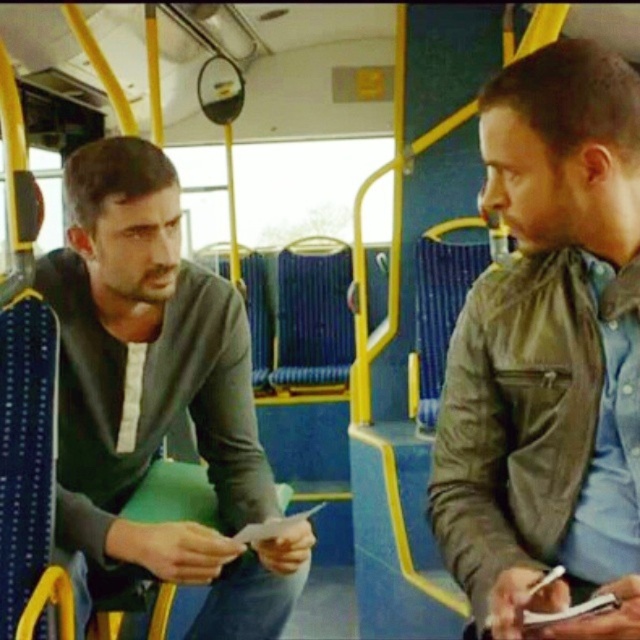
This screenshot has height=640, width=640. Describe the element at coordinates (548, 356) in the screenshot. I see `leather jacket at right` at that location.

Can you confirm if leather jacket at right is taller than dark gray sweater at left?

In fact, leather jacket at right may be shorter than dark gray sweater at left.

Which is behind, point (630, 611) or point (257, 602)?

The point (257, 602) is more distant.

At what (x,y) coordinates should I click in order to perform the action: click on leather jacket at right. Please return your answer as a coordinate pair (x, y). The image size is (640, 640). Looking at the image, I should click on (548, 356).